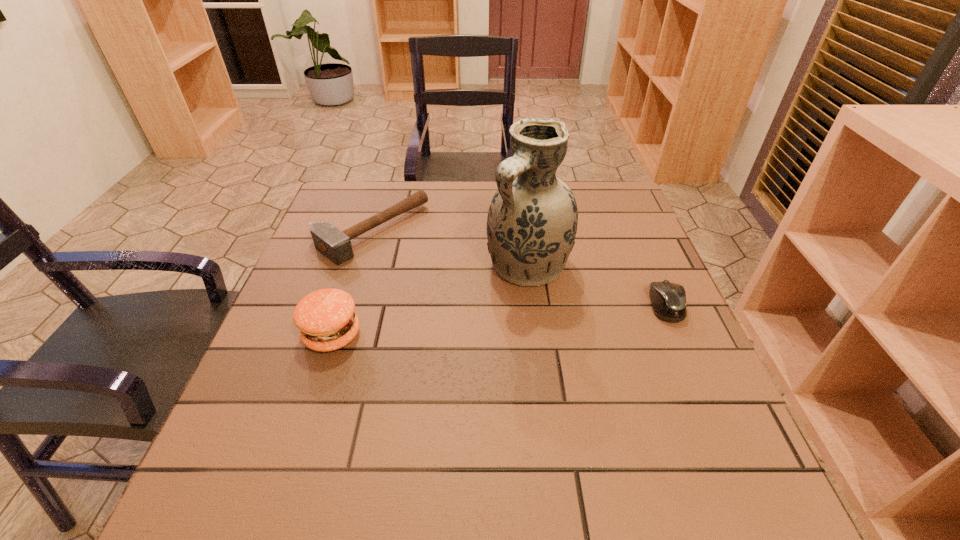
Identify the location of vacant area between the patty and the mouse. The image size is (960, 540). (499, 320).

Image resolution: width=960 pixels, height=540 pixels. I want to click on object that stands as the second closest to the third object from left to right, so click(x=336, y=245).

This screenshot has width=960, height=540. Find the location of `object that is the closest to the hammer`. object that is the closest to the hammer is located at coordinates (326, 319).

Where is `vacant space that satisfies the following two spatial constraints: 1. on the back side of the patty; 2. on the left side of the rightmost object`? vacant space that satisfies the following two spatial constraints: 1. on the back side of the patty; 2. on the left side of the rightmost object is located at coordinates (342, 305).

The image size is (960, 540). I want to click on free space that satisfies the following two spatial constraints: 1. on the front side of the hammer; 2. on the right side of the mouse, so click(x=349, y=305).

The image size is (960, 540). I want to click on vacant space that satisfies the following two spatial constraints: 1. on the front side of the hammer; 2. on the left side of the mouse, so click(x=349, y=305).